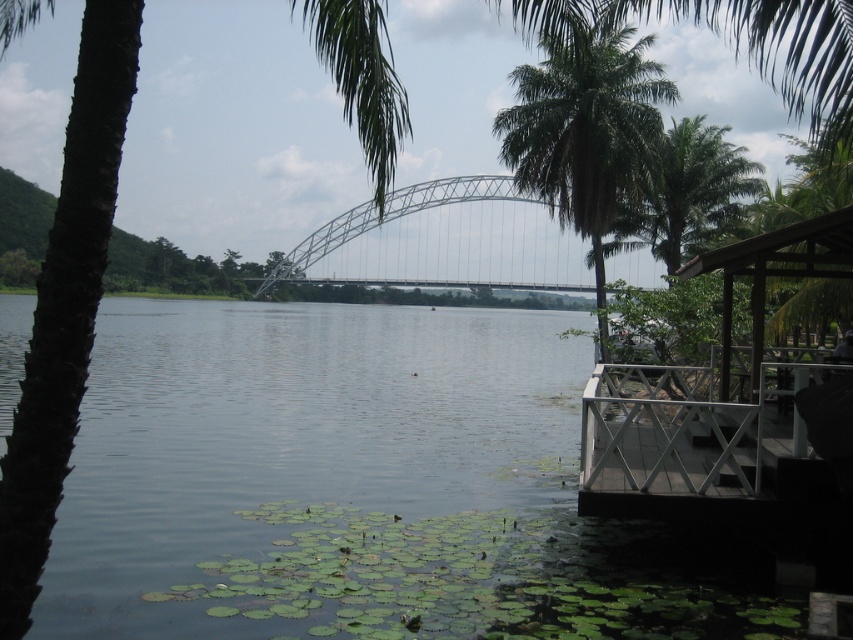
Is green leafy palm tree at upper center shorter than green leafy palm tree at upper right?

In fact, green leafy palm tree at upper center may be taller than green leafy palm tree at upper right.

You are a GUI agent. You are given a task and a screenshot of the screen. Output one action in this format:
    pyautogui.click(x=<x>, y=<y>)
    Task: Click on the green leafy palm tree at upper center
    The height and width of the screenshot is (640, 853).
    Given the screenshot: What is the action you would take?
    pyautogui.click(x=584, y=128)

Does white metal dock at lower right have a greater width compared to green leafy palm tree at upper right?

No, white metal dock at lower right is not wider than green leafy palm tree at upper right.

At what (x,y) coordinates should I click in order to perform the action: click on white metal dock at lower right. Please return your answer as a coordinate pair (x, y). Looking at the image, I should click on (695, 444).

Is point (535, 216) behind point (717, 221)?

Yes.

Which of these two, metallic gray bridge at center or green leafy palm tree at upper right, stands shorter?

With less height is green leafy palm tree at upper right.

This screenshot has width=853, height=640. I want to click on metallic gray bridge at center, so click(444, 241).

At what (x,y) coordinates should I click in order to perform the action: click on metallic gray bridge at center. Please return your answer as a coordinate pair (x, y). Looking at the image, I should click on (444, 241).